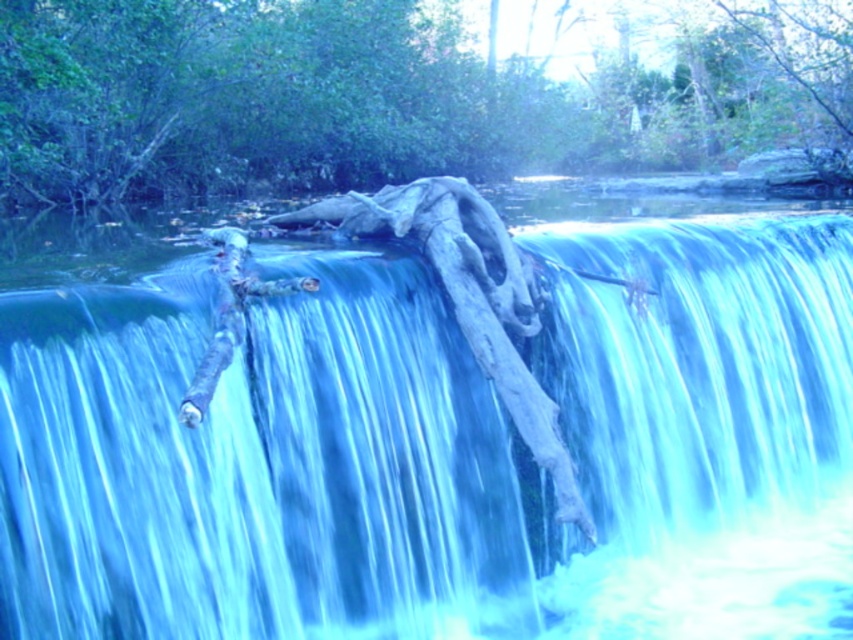
Question: Does smooth wood log at center have a lesser width compared to smooth bark log at center?

Choices:
 (A) yes
 (B) no

Answer: (A)

Question: Which object is farther from the camera taking this photo?

Choices:
 (A) smooth bark log at center
 (B) smooth wood log at center

Answer: (A)

Question: Does smooth wood log at center come behind smooth bark log at center?

Choices:
 (A) yes
 (B) no

Answer: (B)

Question: Does smooth wood log at center appear on the right side of smooth bark log at center?

Choices:
 (A) no
 (B) yes

Answer: (A)

Question: Which object appears farthest from the camera in this image?

Choices:
 (A) smooth bark log at center
 (B) smooth wood log at center

Answer: (A)